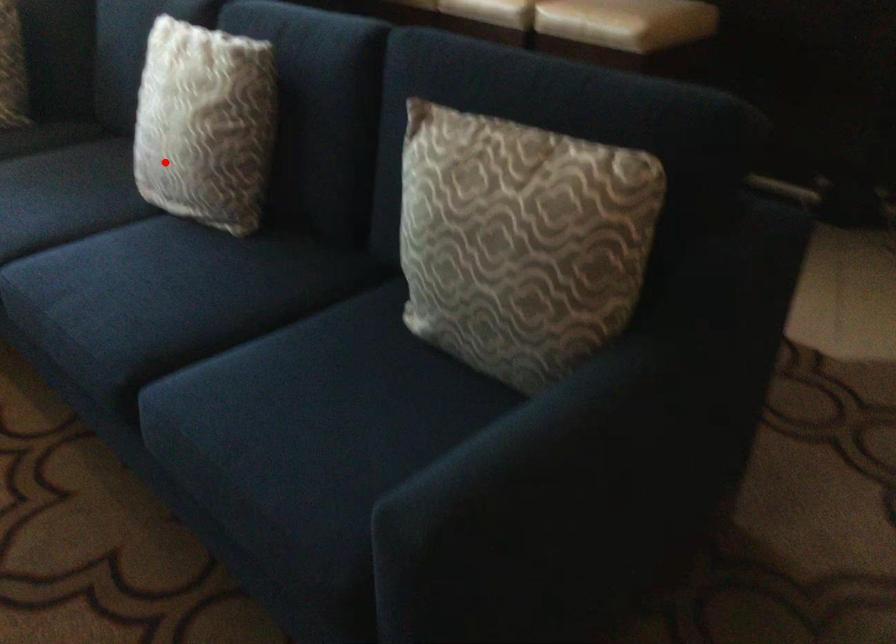
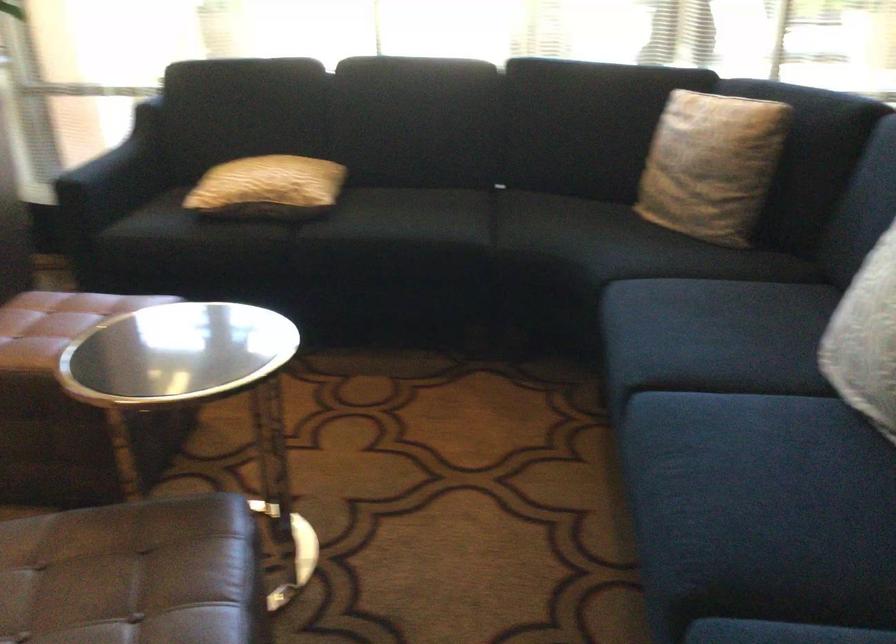
The point at the highlighted location is marked in the first image. Where is the corresponding point in the second image?

(866, 339)